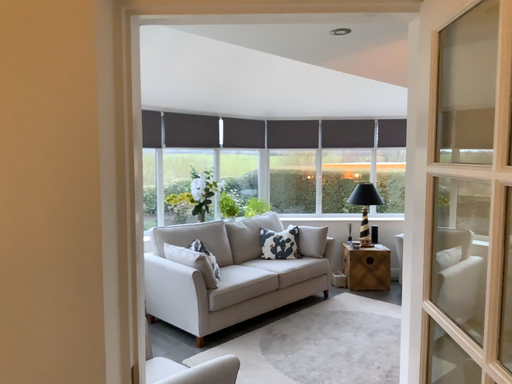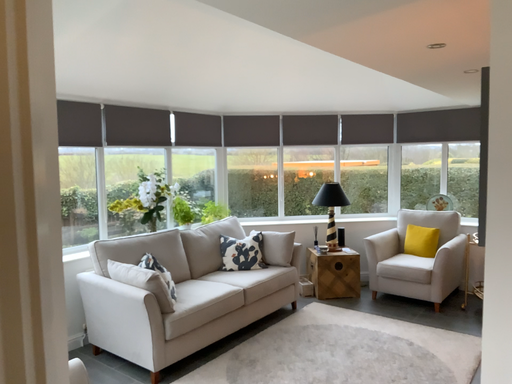
Question: Which way did the camera rotate in the video?

Choices:
 (A) rotated left
 (B) rotated right

Answer: (B)